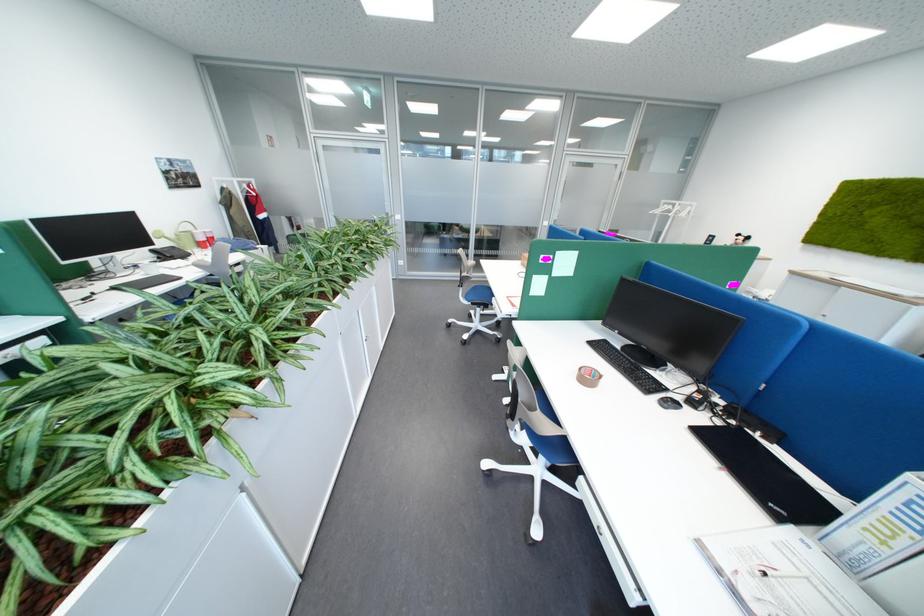
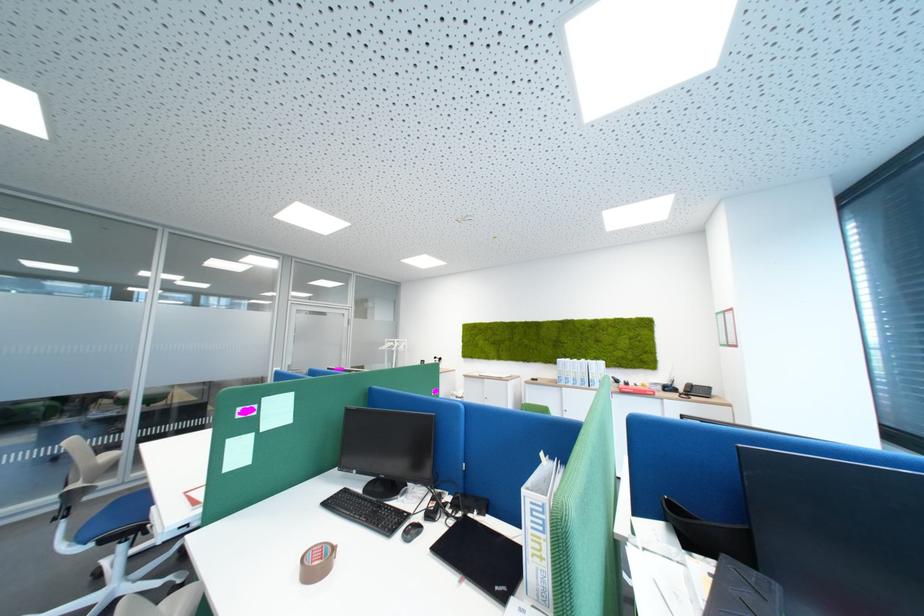
Find the pixel in the second image that matches (x=601, y=379) in the first image.

(330, 565)